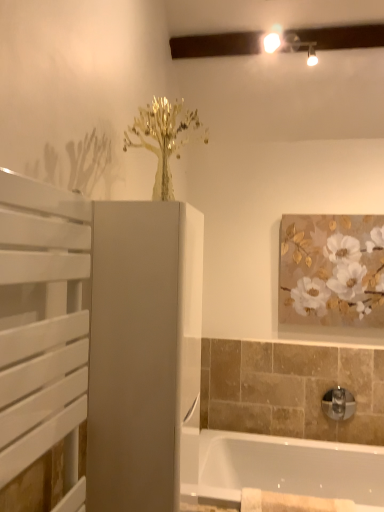
Question: From a real-world perspective, is white slatted screen door at left, the 1th screen door from the left, under matte white cabinet at center, the first screen door when ordered from right to left?

Choices:
 (A) no
 (B) yes

Answer: (A)

Question: Is white slatted screen door at left, the 2th screen door in the back-to-front sequence, aimed at matte white cabinet at center, the 2th screen door from the left?

Choices:
 (A) no
 (B) yes

Answer: (A)

Question: Considering the relative sizes of white slatted screen door at left, the 2th screen door when ordered from right to left, and matte white cabinet at center, which appears as the 1th screen door when viewed from the back, in the image provided, is white slatted screen door at left, the 2th screen door when ordered from right to left, smaller than matte white cabinet at center, which appears as the 1th screen door when viewed from the back,?

Choices:
 (A) yes
 (B) no

Answer: (A)

Question: Is white slatted screen door at left, the 1th screen door from the left, oriented away from matte white cabinet at center, the first screen door when ordered from right to left?

Choices:
 (A) no
 (B) yes

Answer: (A)

Question: Considering the relative sizes of white slatted screen door at left, the 2th screen door when ordered from right to left, and matte white cabinet at center, the first screen door when ordered from right to left, in the image provided, is white slatted screen door at left, the 2th screen door when ordered from right to left, taller than matte white cabinet at center, the first screen door when ordered from right to left,?

Choices:
 (A) no
 (B) yes

Answer: (A)

Question: Looking at the image, does white slatted screen door at left, which appears as the 1th screen door when viewed from the front, seem bigger or smaller compared to white glossy bathtub at lower right?

Choices:
 (A) small
 (B) big

Answer: (A)

Question: Relative to white glossy bathtub at lower right, is white slatted screen door at left, the 2th screen door in the back-to-front sequence, in front or behind?

Choices:
 (A) behind
 (B) front

Answer: (B)

Question: Looking at their shapes, would you say white slatted screen door at left, the 2th screen door in the back-to-front sequence, is wider or thinner than white glossy bathtub at lower right?

Choices:
 (A) thin
 (B) wide

Answer: (A)

Question: Does point (28, 185) appear closer or farther from the camera than point (261, 446)?

Choices:
 (A) closer
 (B) farther

Answer: (A)

Question: From a real-world perspective, is chrome metallic tap at lower right positioned above or below matte white cabinet at center, the 2th screen door viewed from the front?

Choices:
 (A) below
 (B) above

Answer: (A)

Question: In terms of height, does chrome metallic tap at lower right look taller or shorter compared to matte white cabinet at center, the first screen door when ordered from right to left?

Choices:
 (A) tall
 (B) short

Answer: (B)

Question: From the image's perspective, is chrome metallic tap at lower right above or below matte white cabinet at center, which appears as the 1th screen door when viewed from the back?

Choices:
 (A) below
 (B) above

Answer: (A)

Question: In terms of size, does chrome metallic tap at lower right appear bigger or smaller than matte white cabinet at center, the 2th screen door viewed from the front?

Choices:
 (A) big
 (B) small

Answer: (B)

Question: Is gold textured painting at upper right to the left or to the right of chrome metallic tap at lower right in the image?

Choices:
 (A) right
 (B) left

Answer: (B)

Question: Considering the positions of gold textured painting at upper right and chrome metallic tap at lower right in the image, is gold textured painting at upper right wider or thinner than chrome metallic tap at lower right?

Choices:
 (A) wide
 (B) thin

Answer: (B)